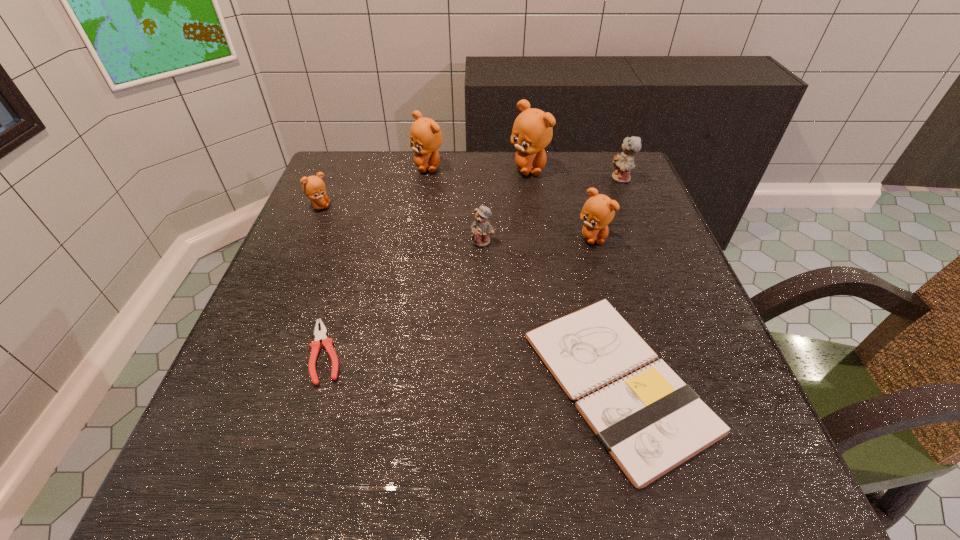
Locate an element on the screen. the tallest teddy bear is located at coordinates (532, 131).

Locate an element on the screen. This screenshot has width=960, height=540. the second brown teddy bear from right to left is located at coordinates (532, 131).

At what (x,y) coordinates should I click in order to perform the action: click on the fifth teddy bear from right to left. Please return your answer as a coordinate pair (x, y). Looking at the image, I should click on (425, 135).

At what (x,y) coordinates should I click in order to perform the action: click on the second tallest teddy bear. Please return your answer as a coordinate pair (x, y). This screenshot has height=540, width=960. Looking at the image, I should click on pos(425,135).

This screenshot has height=540, width=960. I want to click on the rightmost teddy bear, so click(x=623, y=163).

This screenshot has height=540, width=960. Find the location of `the right blue teddy bear`. the right blue teddy bear is located at coordinates (623, 163).

This screenshot has height=540, width=960. I want to click on the third biggest brown teddy bear, so click(x=598, y=211).

Locate an element on the screen. the rightmost brown teddy bear is located at coordinates (x=598, y=211).

I want to click on the leftmost brown teddy bear, so click(314, 188).

This screenshot has width=960, height=540. Find the location of `the leftmost object`. the leftmost object is located at coordinates (314, 188).